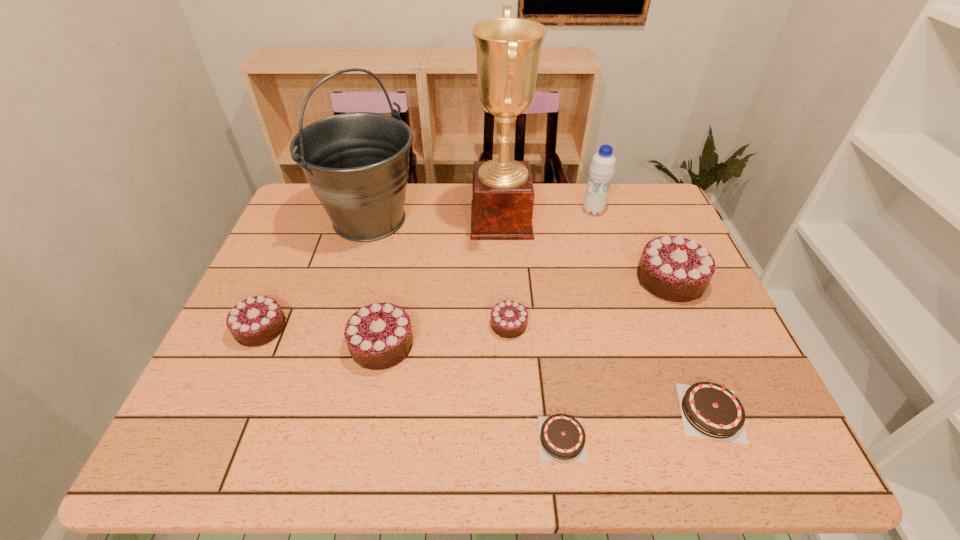
The image size is (960, 540). Identify the location of water bottle located in the far edge section of the desktop. (293, 436).

Image resolution: width=960 pixels, height=540 pixels. Identify the location of bucket that is at the left edge. click(293, 436).

In order to click on chocolate cake positioned at the left edge in this screenshot , I will do [x=251, y=417].

Find the location of a particular element. The height and width of the screenshot is (540, 960). object that is at the far left corner is located at coordinates (293, 436).

Locate an element on the screen. The image size is (960, 540). object present at the near right corner is located at coordinates (293, 436).

Locate an element on the screen. free space at the far edge is located at coordinates point(540,184).

You are a GUI agent. You are given a task and a screenshot of the screen. Output one action in this format:
    pyautogui.click(x=<x>, y=<y>)
    Task: Click on the free space at the right edge of the desktop
    
    Given the screenshot: What is the action you would take?
    (x=692, y=417)

Identify which object is located as the eighth nearest to the fourth shortest object. Please provide its 2D coordinates. Your answer should be formatted as a tuple, i.e. [(x, y)], where the tuple contains the x and y coordinates of a point satisfying the conditions above.

[(627, 309)]

Locate an element on the screen. The height and width of the screenshot is (540, 960). object that ranks as the fourth closest to the sixth nearest object is located at coordinates (293, 436).

Identify which chocolate cake is the third closest to the eighth shortest object. Please provide its 2D coordinates. Your answer should be formatted as a tuple, i.e. [(x, y)], where the tuple contains the x and y coordinates of a point satisfying the conditions above.

[(293, 436)]